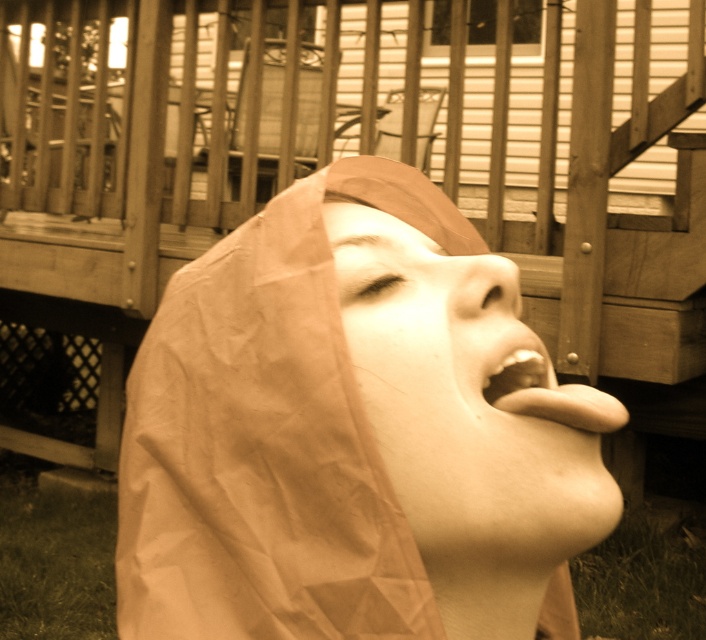
You are a delivery person who needs to place a package on the ground near the brown paper bag at center. According to the image, where should you place the package so it doesn

The brown paper bag at center is located at point (352, 433). To place the package near it, you should position it close to those coordinates.

You are a delivery person trying to place a package on the ground near the brown paper bag at center without disturbing the person resting under it. Based on the coordinates provided, can you determine if the package will be placed safely away from the person?

The brown paper bag at center is located at point [352,433]. Since the package needs to be placed near the brown paper bag at center, it will be placed close to the person resting under it, potentially disturbing them. Choose a different location further away.

You are a photographer trying to capture a closeup shot of the matte paper mask at center and the matte brown paper at lower center. Which object should you focus on first to ensure both are in focus without moving the camera?

You should focus on the matte paper mask at center first because it is closer to the viewer than the matte brown paper at lower center. By focusing on the closer object, the farther one will also be in focus due to the depth of field.